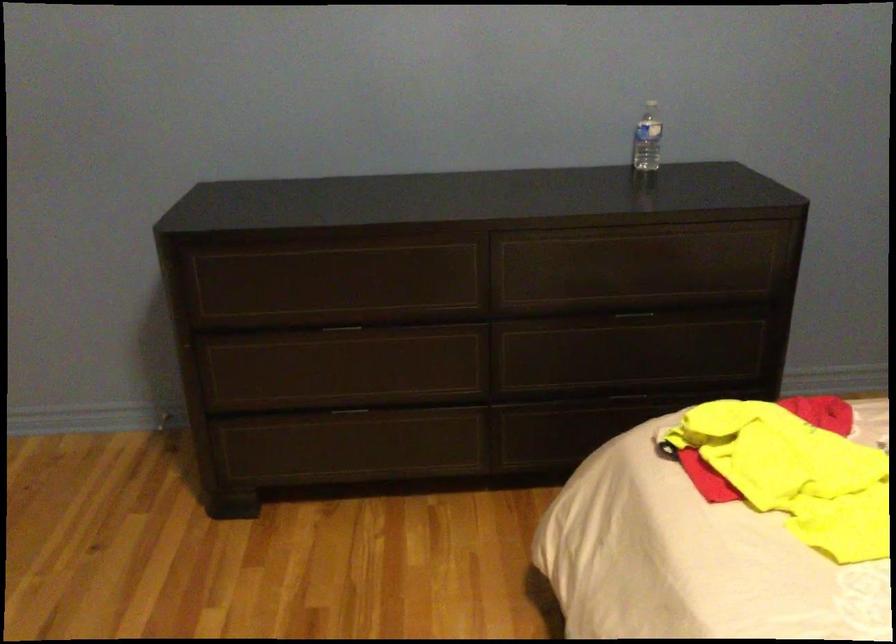
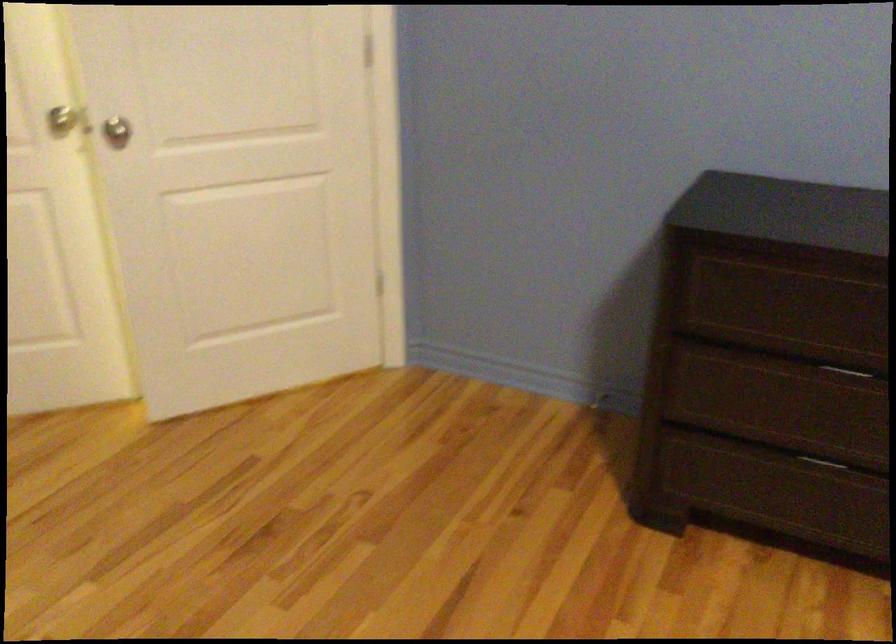
In a continuous first-person perspective shot, in which direction is the camera moving?

The movement direction of the cameraman is left, forward.